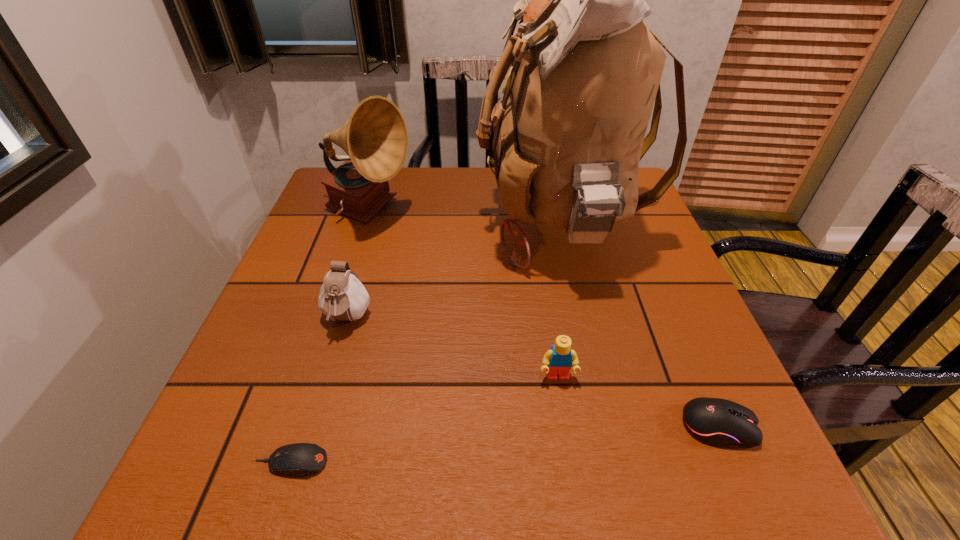
Identify the location of free spot that satisfies the following two spatial constraints: 1. on the horn of the fifth shortest object; 2. on the left side of the second shortest object. The width and height of the screenshot is (960, 540). (303, 426).

Where is `vacant space that satisfies the following two spatial constraints: 1. on the horn of the fifth shortest object; 2. on the right side of the right computer mouse`? vacant space that satisfies the following two spatial constraints: 1. on the horn of the fifth shortest object; 2. on the right side of the right computer mouse is located at coordinates 303,426.

Find the location of a particular element. The image size is (960, 540). free space that satisfies the following two spatial constraints: 1. on the front-facing side of the second shortest object; 2. on the left side of the third shortest object is located at coordinates (564, 426).